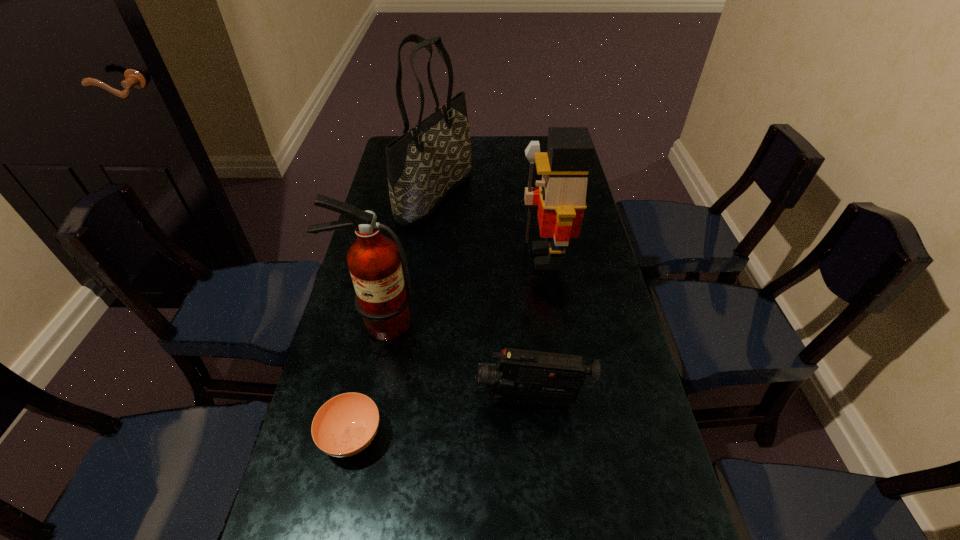
The image size is (960, 540). I want to click on free space located on the nozzle and handle of the third nearest object, so click(x=369, y=363).

Where is `free spot located 0.140m on the front-facing side of the fourth tallest object`? free spot located 0.140m on the front-facing side of the fourth tallest object is located at coordinates (414, 400).

Identify the location of free location located 0.310m on the front-facing side of the fourth tallest object. This screenshot has width=960, height=540. (338, 400).

Image resolution: width=960 pixels, height=540 pixels. In order to click on free region located on the front-facing side of the fourth tallest object in this screenshot , I will do point(436,400).

Where is `blank space located on the back of the shortest object`? This screenshot has width=960, height=540. blank space located on the back of the shortest object is located at coordinates (375, 327).

Find the location of a particular element. object present at the far edge is located at coordinates (425, 164).

The image size is (960, 540). In order to click on tote bag situated at the left edge in this screenshot , I will do `click(425, 164)`.

This screenshot has width=960, height=540. What are the coordinates of `fire extinguisher that is at the left edge` in the screenshot? It's located at (382, 299).

Where is `soup bowl that is positioned at the left edge`? The width and height of the screenshot is (960, 540). soup bowl that is positioned at the left edge is located at coordinates (345, 425).

Find the location of `nutcracker located in the right edge section of the desktop`. nutcracker located in the right edge section of the desktop is located at coordinates (561, 196).